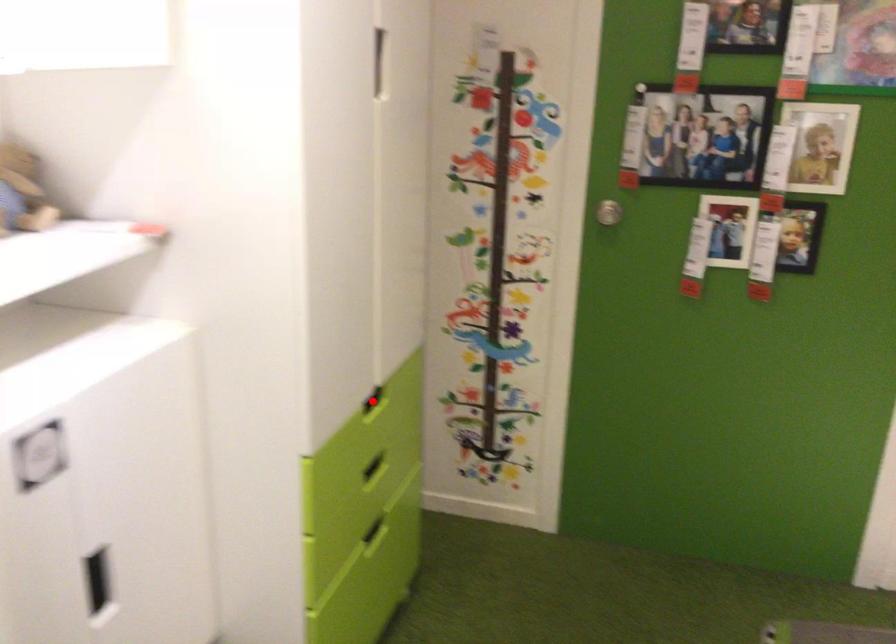
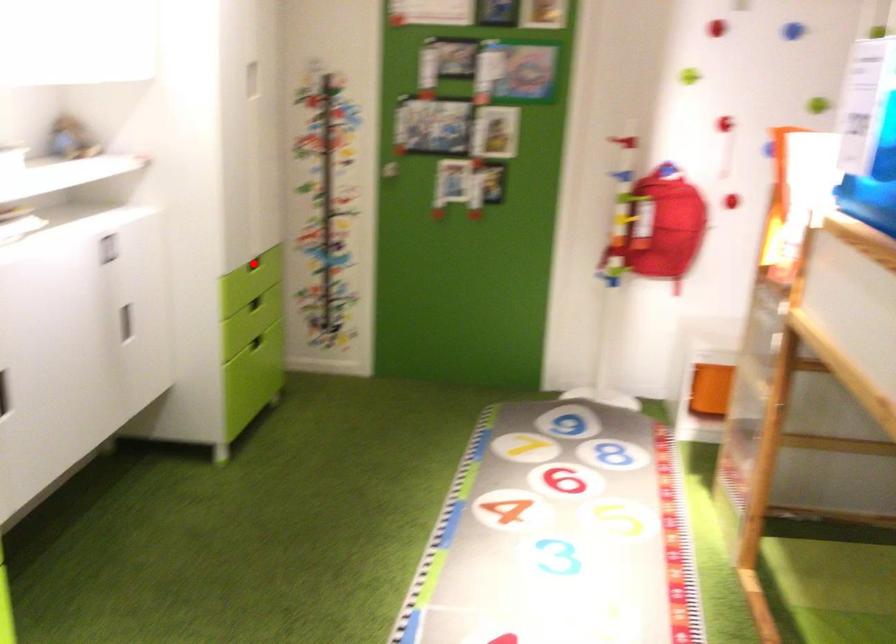
I am providing you with two images of the same scene from different viewpoints. A red point is marked on the first image and another point is marked on the second image. Does the point marked in image1 correspond to the same location as the one in image2?

No